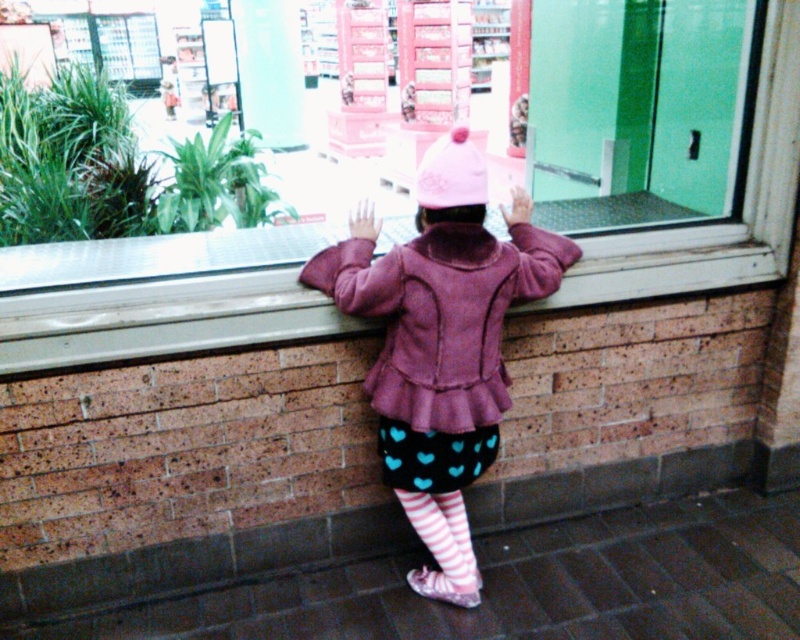
Question: Which point is farther to the camera?

Choices:
 (A) (422, 168)
 (B) (424, 580)

Answer: (B)

Question: Which point is closer to the camera?

Choices:
 (A) purple fuzzy jacket at center
 (B) pink fabric hat at center
 (C) smooth concrete window sill at center

Answer: (C)

Question: Which object is positioned closest to the smooth concrete window sill at center?

Choices:
 (A) pink fabric hat at center
 (B) pink fleece jacket at center

Answer: (B)

Question: In this image, where is purple fuzzy jacket at center located relative to striped cotton socks at lower center?

Choices:
 (A) above
 (B) below

Answer: (A)

Question: Can you confirm if transparent glass shop window at center is bigger than purple fuzzy jacket at center?

Choices:
 (A) yes
 (B) no

Answer: (A)

Question: Is pink fleece jacket at center to the left of smooth concrete window sill at center from the viewer's perspective?

Choices:
 (A) yes
 (B) no

Answer: (B)